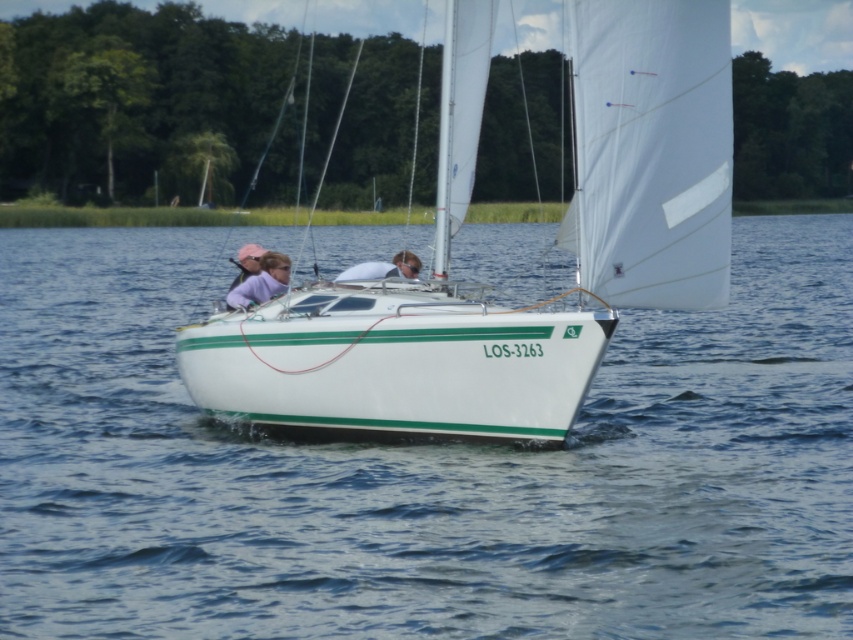
You are a passenger on the sailboat and need to locate your belongings stored under the seats. Which person is wearing a matte purple shirt at center that is positioned below the matte white shirt at center?

The person wearing the matte purple shirt at center is located below the matte white shirt at center, so you should look near the area where the matte white shirt at center is positioned to find the belongings stored under the seats.

You are a passenger on the sailboat and want to move from the steering area to the front seat. Which point, point (273, 289) or point (404, 273), is closer to your current position?

Point (273, 289) is closer to your current position because it is further to the viewer than point (404, 273), meaning it is nearer to where you are standing.